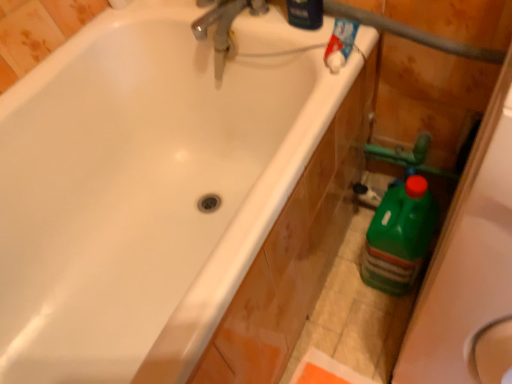
Question: From the image's perspective, is blue glossy bottle at upper right, placed as the 1th cleaning product when sorted from top to bottom, above or below white glossy bathtub at upper left?

Choices:
 (A) above
 (B) below

Answer: (A)

Question: Based on their sizes in the image, would you say blue glossy bottle at upper right, which ranks as the 1th cleaning product in front-to-back order, is bigger or smaller than white glossy bathtub at upper left?

Choices:
 (A) small
 (B) big

Answer: (A)

Question: Which object is the closest to the blue glossy bottle at upper right, placed as the second cleaning product when sorted from back to front?

Choices:
 (A) green plastic bottle at right, which is counted as the first cleaning product, starting from the bottom
 (B) metallic chrome faucet at upper center
 (C) white glossy bathtub at upper left

Answer: (B)

Question: Based on their relative distances, which object is nearer to the metallic chrome faucet at upper center?

Choices:
 (A) white glossy bathtub at upper left
 (B) green plastic bottle at right, which is the 2th cleaning product from left to right
 (C) blue glossy bottle at upper right, which ranks as the 1th cleaning product in front-to-back order

Answer: (C)